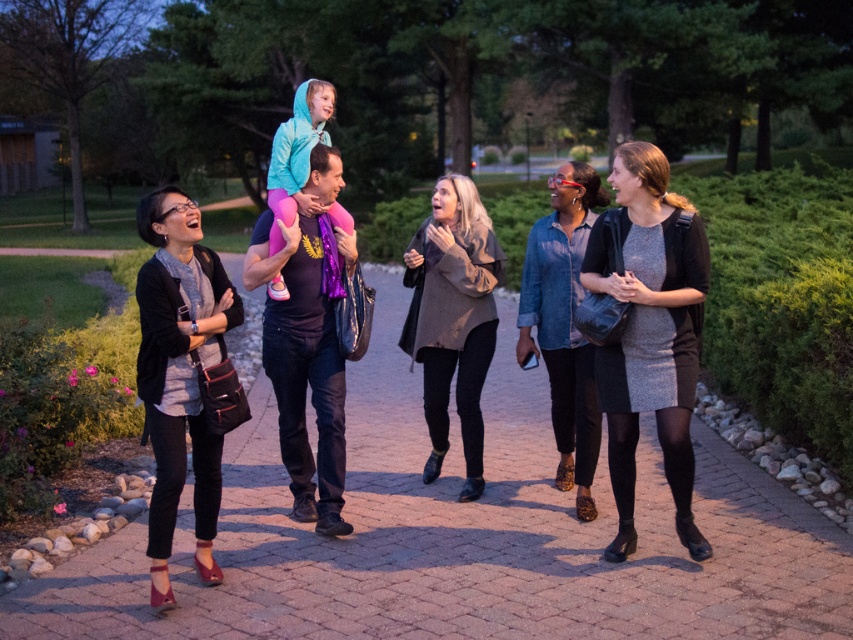
Is brick pavement at center thinner than matte blue jacket at center?

Yes, brick pavement at center is thinner than matte blue jacket at center.

This screenshot has width=853, height=640. What do you see at coordinates (461, 536) in the screenshot?
I see `brick pavement at center` at bounding box center [461, 536].

Locate an element on the screen. This screenshot has width=853, height=640. brick pavement at center is located at coordinates (461, 536).

Does matte black jacket at center have a lesser height compared to matte black bag at left?

No, matte black jacket at center is not shorter than matte black bag at left.

Which is above, matte black jacket at center or matte black bag at left?

matte black jacket at center is above.

I want to click on matte black jacket at center, so click(305, 356).

This screenshot has height=640, width=853. In order to click on matte black jacket at center in this screenshot , I will do `click(305, 356)`.

Does matte black bag at left come in front of denim shirt at center?

Yes.

Is point (148, 360) positioned behind point (584, 390)?

No, (148, 360) is closer to viewer.

Locate an element on the screen. matte black bag at left is located at coordinates (178, 372).